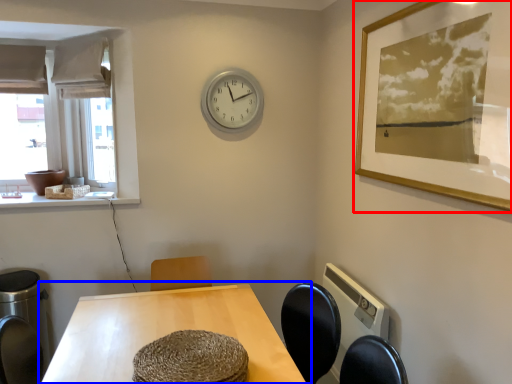
Question: Which of the following is the closest to the observer, picture frame (highlighted by a red box) or table (highlighted by a blue box)?

Choices:
 (A) picture frame
 (B) table

Answer: (A)